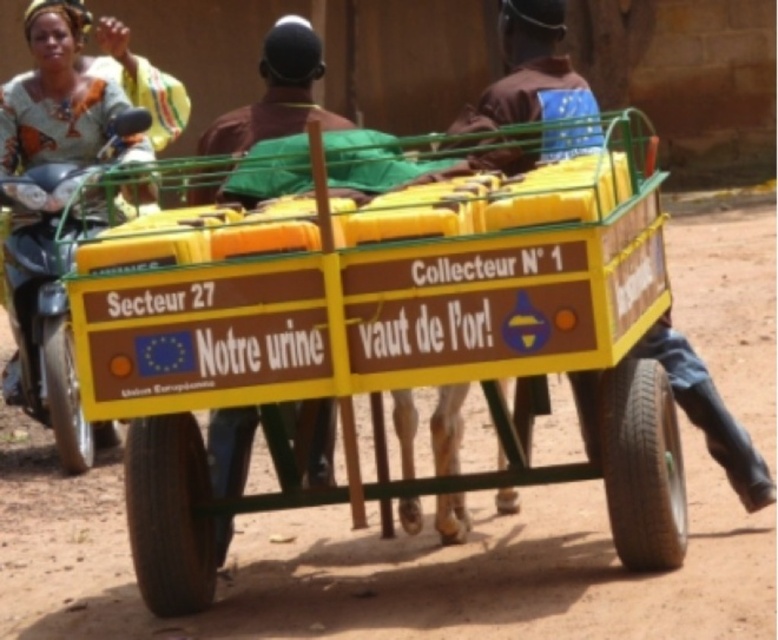
From the picture: You are a photographer trying to capture the yellow plastic cart at center and the metallic silver motorcycle at left in a single shot. Based on their positions, which object should you place closer to the left edge of your camera frame?

The metallic silver motorcycle at left should be placed closer to the left edge of the camera frame because the yellow plastic cart at center is to the right of the metallic silver motorcycle at left.

You are a photographer trying to capture both the brown leather jacket at center and the metallic silver motorcycle at left in a single frame. Based on their heights, which object will appear smaller in the photo?

The brown leather jacket at center appears smaller in the photo because it has a lesser height compared to the metallic silver motorcycle at left.